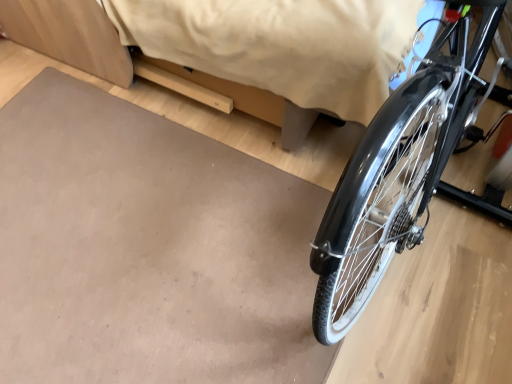
Locate an element on the screen. The image size is (512, 384). vacant space situated above matte gray mat at lower right (from a real-world perspective) is located at coordinates (134, 238).